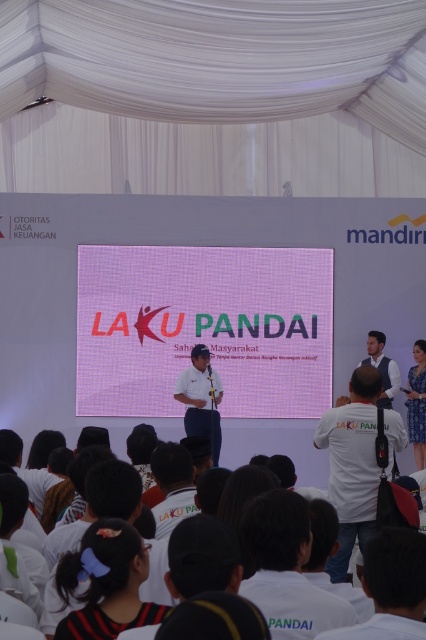
Does blue printed dress at center lie behind light brown leather jacket at right?

Yes, it is behind light brown leather jacket at right.

Who is shorter, blue printed dress at center or light brown leather jacket at right?

light brown leather jacket at right

Does point (408, 371) come in front of point (383, 355)?

No, (408, 371) is further to viewer.

The image size is (426, 640). Identify the location of blue printed dress at center. (417, 403).

Is white matte shirt at center positioned before light brown leather jacket at right?

Yes, white matte shirt at center is in front of light brown leather jacket at right.

Can you confirm if white matte shirt at center is smaller than light brown leather jacket at right?

No, white matte shirt at center is not smaller than light brown leather jacket at right.

Which is behind, point (360, 380) or point (393, 384)?

The point (393, 384) is behind.

At what (x,y) coordinates should I click in order to perform the action: click on white matte shirt at center. Please return your answer as a coordinate pair (x, y). The image size is (426, 640). Looking at the image, I should click on (351, 465).

Identify the location of white cotton t-shirts at lower center. (296, 445).

Between point (242, 433) and point (389, 362), which one is positioned behind?

Point (242, 433)

Identify the location of white cotton t-shirts at lower center. The image size is (426, 640). (296, 445).